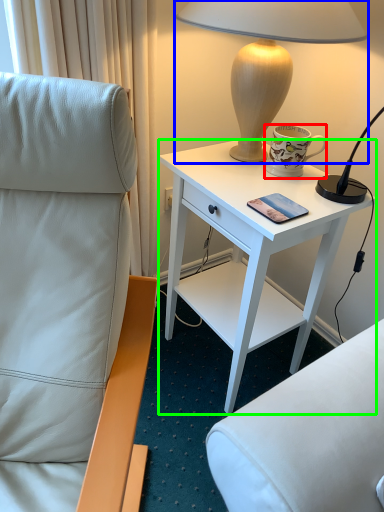
Question: Estimate the real-world distances between objects in this image. Which object is farther from coffee cup (highlighted by a red box), lamp (highlighted by a blue box) or desk (highlighted by a green box)?

Choices:
 (A) lamp
 (B) desk

Answer: (B)